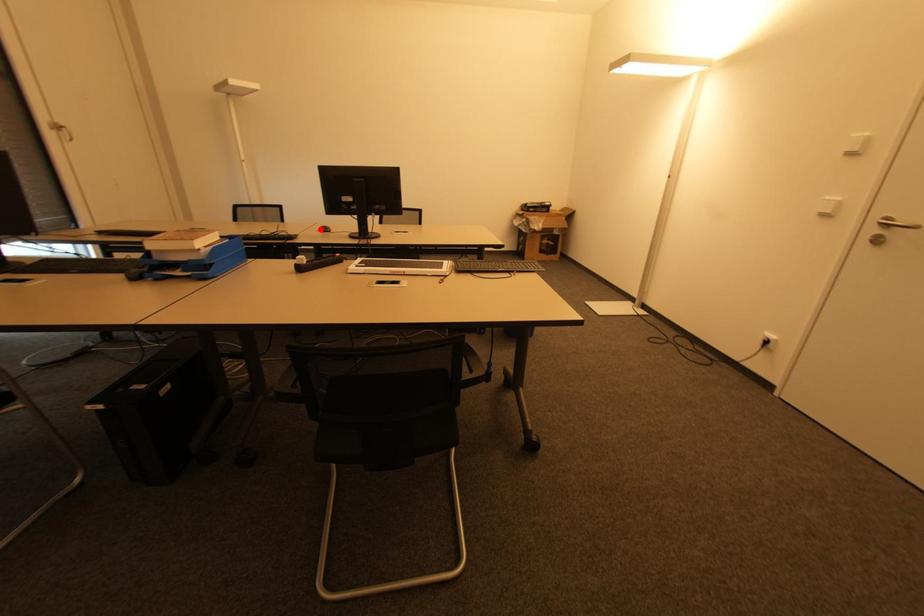
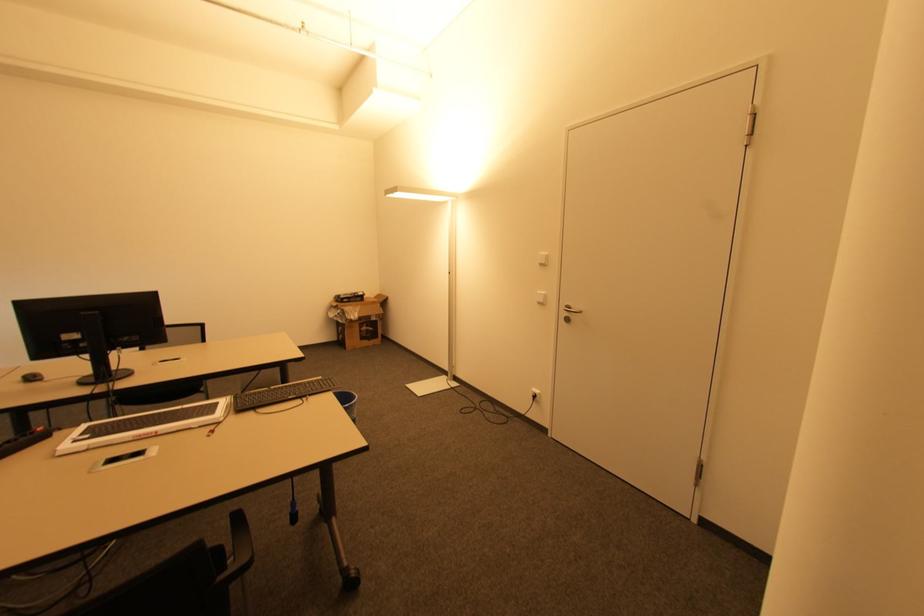
The point at the highlighted location is marked in the first image. Where is the corresponding point in the second image?

(21, 379)